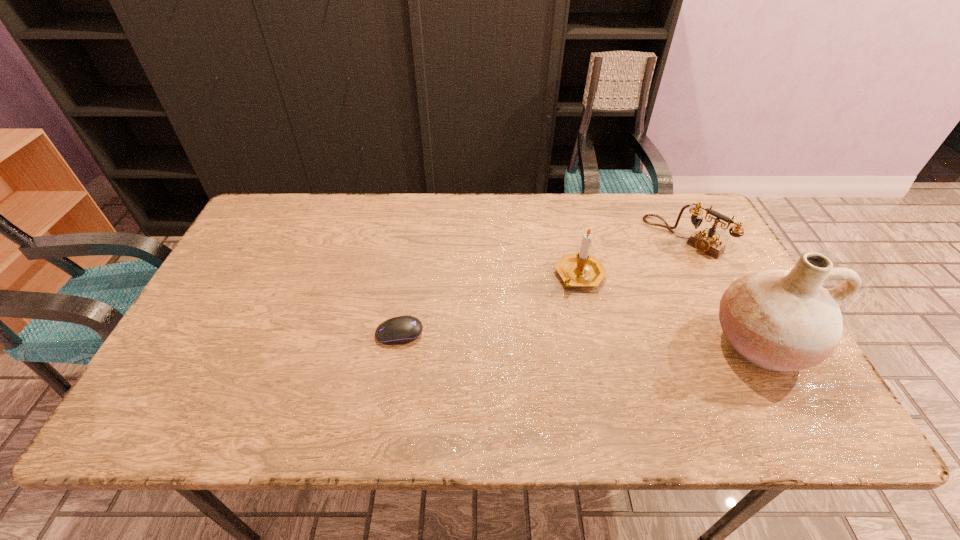
You are a GUI agent. You are given a task and a screenshot of the screen. Output one action in this format:
    pyautogui.click(x=<x>, y=<y>)
    Task: Click on the vacant space at the near edge of the desktop
    Image resolution: width=960 pixels, height=540 pixels.
    Given the screenshot: What is the action you would take?
    pyautogui.click(x=393, y=364)

Where is `free region at the left edge of the desktop`? The image size is (960, 540). free region at the left edge of the desktop is located at coordinates (204, 329).

You are a GUI agent. You are given a task and a screenshot of the screen. Output one action in this format:
    pyautogui.click(x=<x>, y=<y>)
    Task: Click on the blank space at the right edge of the desktop
    The width and height of the screenshot is (960, 540).
    Given the screenshot: What is the action you would take?
    pyautogui.click(x=671, y=249)

Where is `free location at the far left corner`? The image size is (960, 540). free location at the far left corner is located at coordinates (281, 235).

In the image, there is a desktop. Identify the location of vacant space at the near left corner. (183, 387).

The height and width of the screenshot is (540, 960). In the image, there is a desktop. Find the location of `vacant space at the far right corner`. vacant space at the far right corner is located at coordinates (667, 211).

This screenshot has width=960, height=540. What are the coordinates of `empty location between the second shortest object and the second object from left to right` in the screenshot? It's located at (632, 256).

Find the location of a particular element. This screenshot has height=540, width=960. unoccupied area between the third shortest object and the shortest object is located at coordinates (490, 305).

At what (x,y) coordinates should I click in order to perform the action: click on free space between the third tallest object and the second tallest object. Please return your answer as a coordinate pair (x, y). This screenshot has height=540, width=960. Looking at the image, I should click on (632, 256).

This screenshot has height=540, width=960. In order to click on vacant space in between the candle holder and the telephone in this screenshot , I will do `click(632, 256)`.